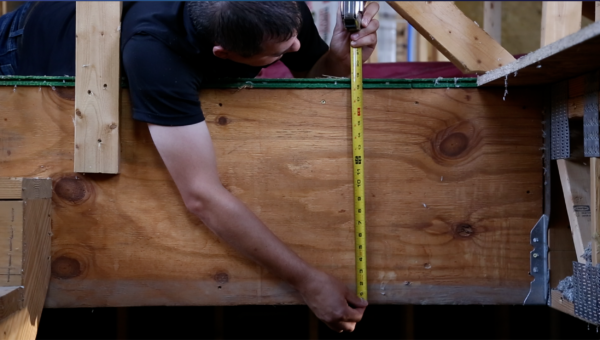
Locate an element on the screen. The image size is (600, 340). stairs is located at coordinates (12, 235).